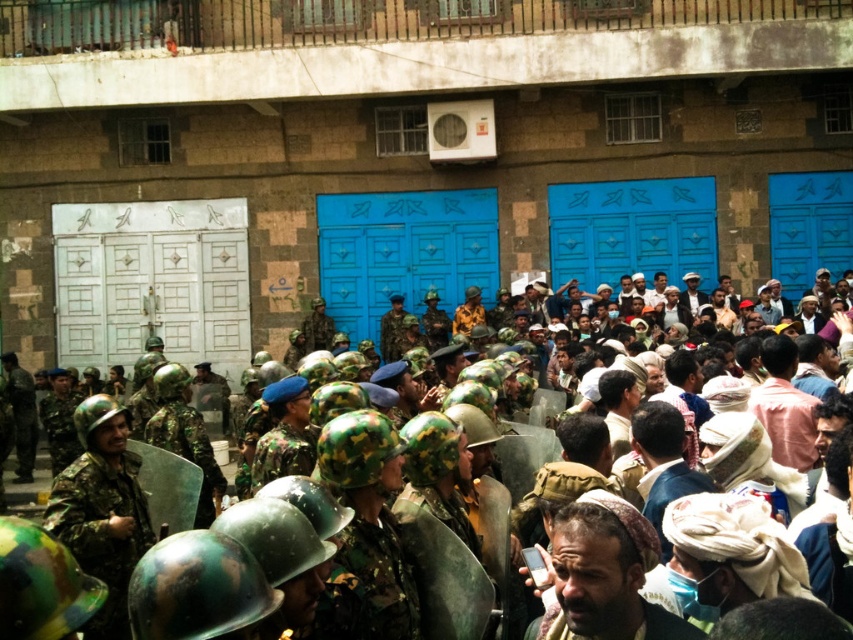
You are a photographer trying to capture a clear shot of both the camouflage helmeted crowd at center and the brown leather cap at center. Given their height difference, which object will appear larger in your photo?

The camouflage helmeted crowd at center will appear larger in the photo because it has a greater height compared to the brown leather cap at center.

You are a journalist trying to capture the scene from the front. You notice the camouflage helmeted crowd at center and the brown leather cap at center. Which object is closer to you?

The camouflage helmeted crowd at center is closer to you because the brown leather cap at center is behind it.

You are a military strategist analyzing the scene. You notice the camouflage helmeted crowd at center and the camouflage uniform at center. Which group has more people?

The camouflage helmeted crowd at center has a larger size compared to the camouflage uniform at center, so the camouflage helmeted crowd at center has more people.